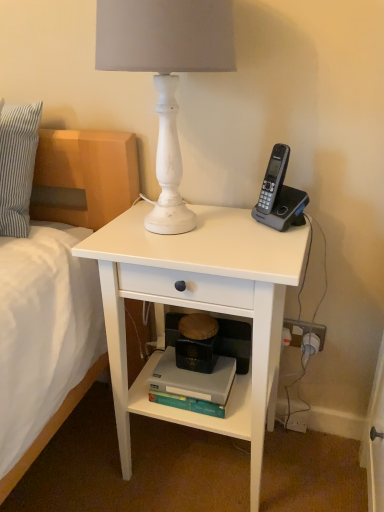
Where is `vacant space in white matte lamp at upper center (from a real-world perspective)`? The image size is (384, 512). vacant space in white matte lamp at upper center (from a real-world perspective) is located at coordinates (175, 231).